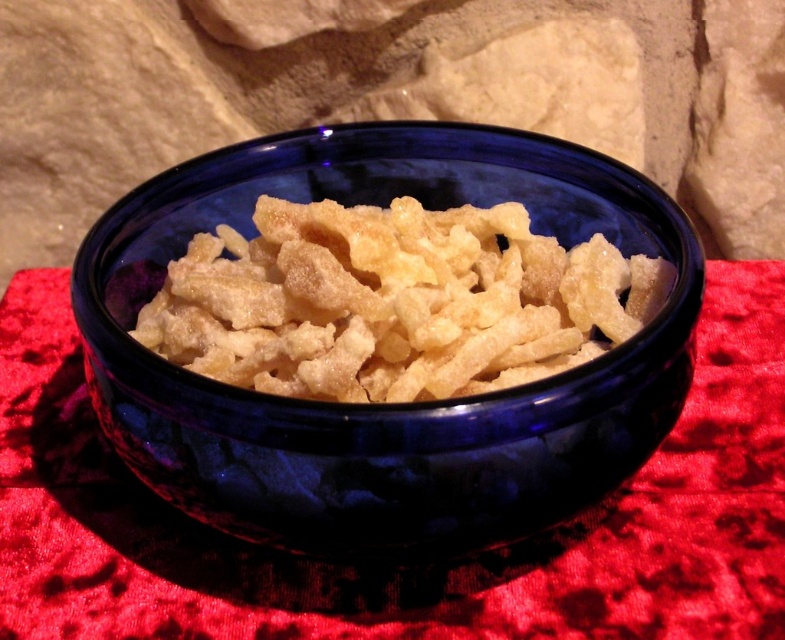
You are looking at the bowl from the front. There are two points marked on the bowl. One is at coordinate point (132, 280) and the other at point (298, 356). Which point is closer to you?

Point (132, 280) is closer to you because it is further to the camera than point (298, 356).

You are a chef preparing a dish and need to determine if the matte yellow cereal at center can fit inside the glossy ceramic bowl at center. Based on their sizes, will it fit?

The glossy ceramic bowl at center is much taller than the matte yellow cereal at center, so the cereal will fit inside the bowl.

You are standing in front of a dark blue ceramic bowl filled with light beige cereal on a red fabric surface. There is a point at coordinates (385, 404). What object is located at that point?

The glossy ceramic bowl at center is located at point (385, 404).